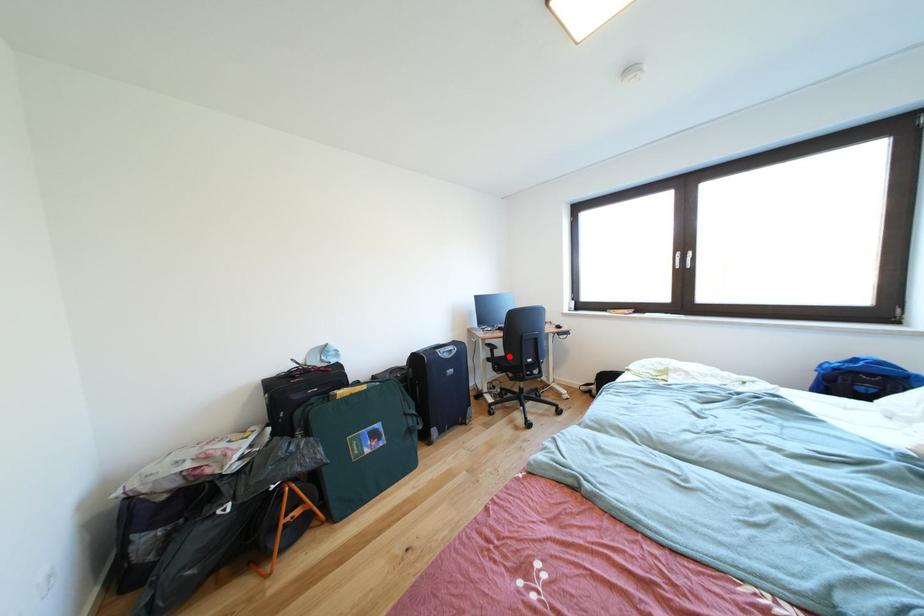
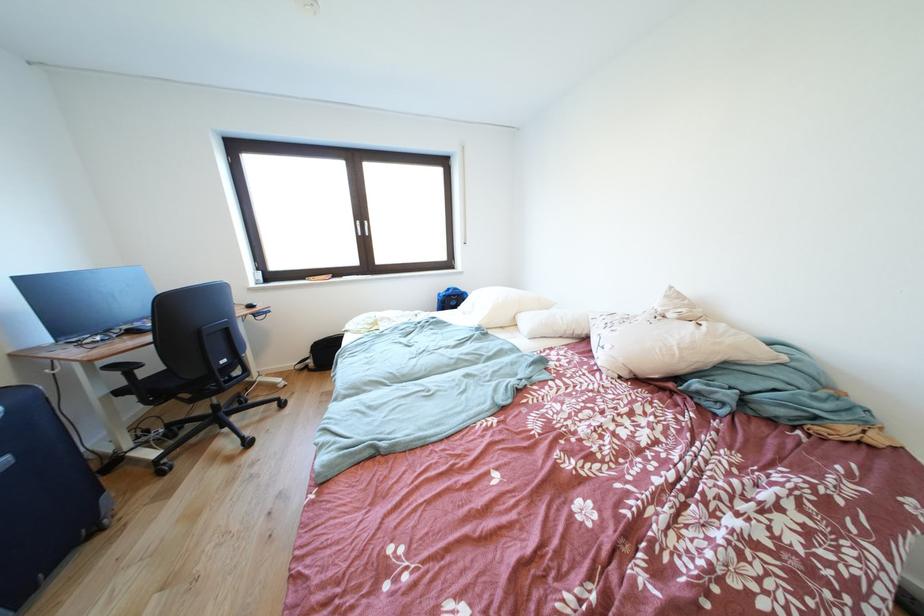
In the second image, find the point that corresponds to the highlighted location in the first image.

(161, 373)